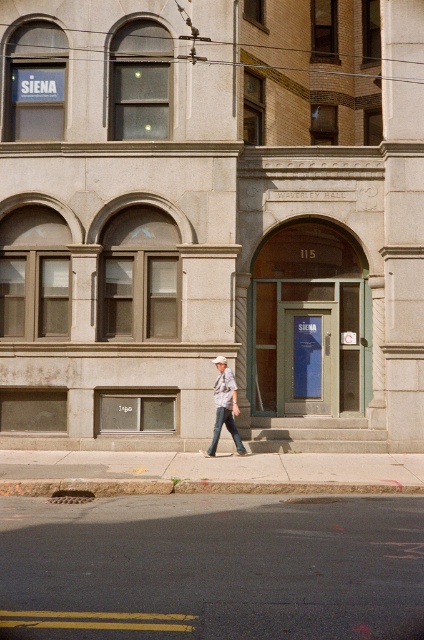
Does black asphalt at lower center appear over denim jeans at center?

Actually, black asphalt at lower center is below denim jeans at center.

Which is more to the left, black asphalt at lower center or denim jeans at center?

denim jeans at center

The height and width of the screenshot is (640, 424). I want to click on black asphalt at lower center, so click(212, 566).

Identify the location of black asphalt at lower center. The image size is (424, 640). (212, 566).